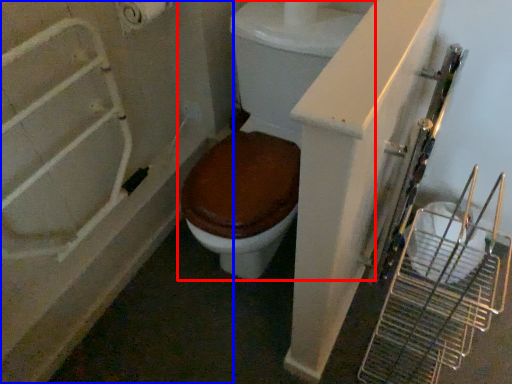
Question: Among these objects, which one is farthest to the camera, toilet (highlighted by a red box) or bath (highlighted by a blue box)?

Choices:
 (A) toilet
 (B) bath

Answer: (B)